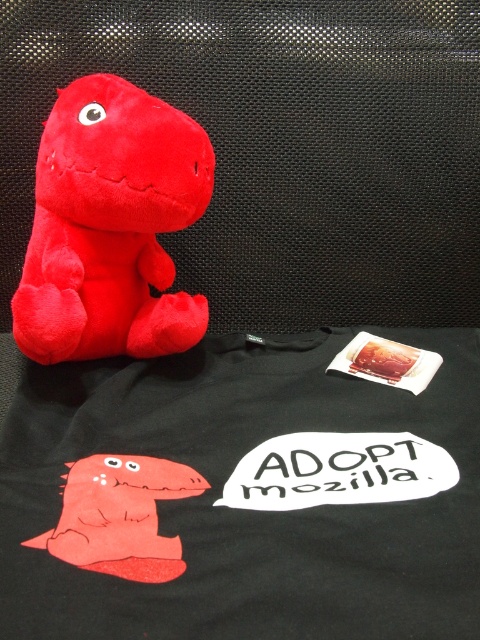
You are a graphic designer working on a project. You need to place a new element between the point at coordinates point (110,225) and the black t shirt with red dinosaur graphic. Where should you place it to ensure it is centered between them?

The point at coordinates point (110,225) indicates matte plush dinosaur at center, so placing the new element halfway between the plush dinosaur at center and the black t shirt with red dinosaur graphic would center it between them.

You are holding a camera and want to take a photo of the point at coordinates point (421, 538). If the camera is currently 21.77 inches away from the point, is the camera positioned correctly to capture the point clearly?

The point (421, 538) is 21.77 inches away from the camera, so the camera is positioned correctly to capture the point clearly.